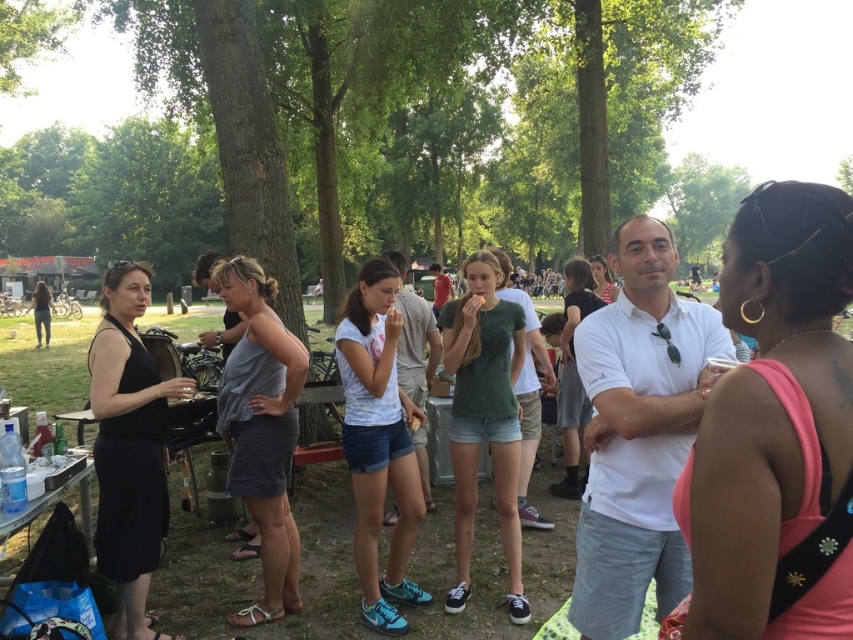
Between pink fabric top at center and white matte shirt at center, which one appears on the right side from the viewer's perspective?

Positioned to the right is pink fabric top at center.

You are a GUI agent. You are given a task and a screenshot of the screen. Output one action in this format:
    pyautogui.click(x=<x>, y=<y>)
    Task: Click on the pink fabric top at center
    The height and width of the screenshot is (640, 853).
    Given the screenshot: What is the action you would take?
    pyautogui.click(x=776, y=432)

The height and width of the screenshot is (640, 853). What are the coordinates of `pink fabric top at center` in the screenshot? It's located at (776, 432).

Is point (155, 396) positioned after point (277, 336)?

No, it is not.

Does black matte dress at left have a lesser width compared to gray fabric dress at center?

No.

This screenshot has width=853, height=640. In order to click on black matte dress at left in this screenshot , I will do `click(129, 448)`.

Who is taller, gray fabric dress at center or green matte t-shirt at center?

With more height is green matte t-shirt at center.

Between gray fabric dress at center and green matte t-shirt at center, which one is positioned higher?

green matte t-shirt at center is above.

What do you see at coordinates (262, 429) in the screenshot? The image size is (853, 640). I see `gray fabric dress at center` at bounding box center [262, 429].

Find the location of `gray fabric dress at center`. gray fabric dress at center is located at coordinates (262, 429).